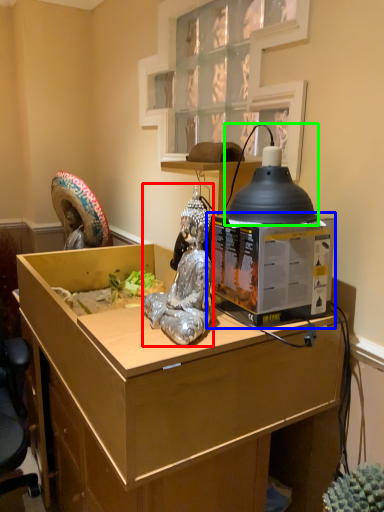
Question: Based on their relative distances, which object is farther from person (highlighted by a red box)? Choose from desktop computer (highlighted by a blue box) and lamp (highlighted by a green box).

Choices:
 (A) desktop computer
 (B) lamp

Answer: (B)